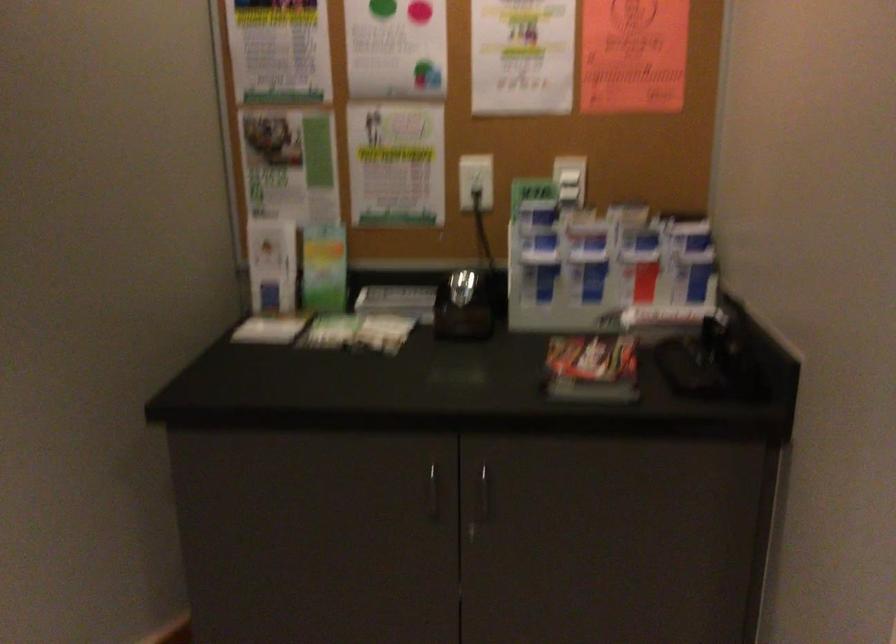
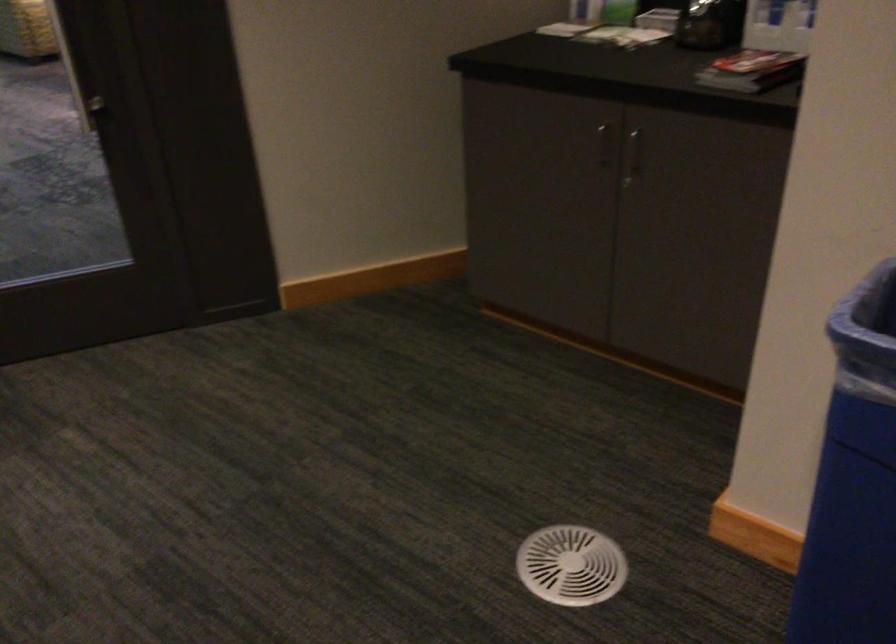
The point at (428, 491) is marked in the first image. Where is the corresponding point in the second image?

(604, 144)